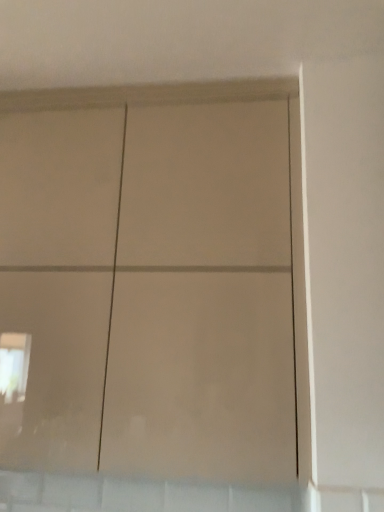
Question: Should I look upward or downward to see matte white cupboard at center?

Choices:
 (A) down
 (B) up

Answer: (A)